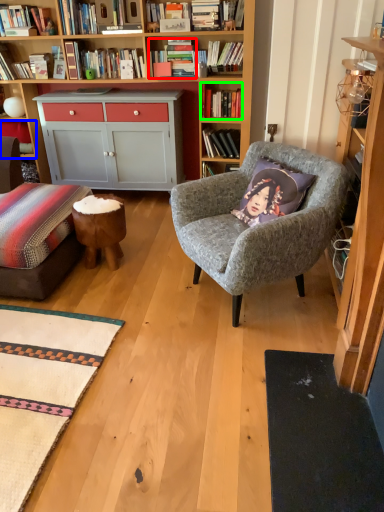
Question: Based on their relative distances, which object is nearer to book (highlighted by a red box)? Choose from shelf (highlighted by a blue box) and book (highlighted by a green box).

Choices:
 (A) shelf
 (B) book

Answer: (B)